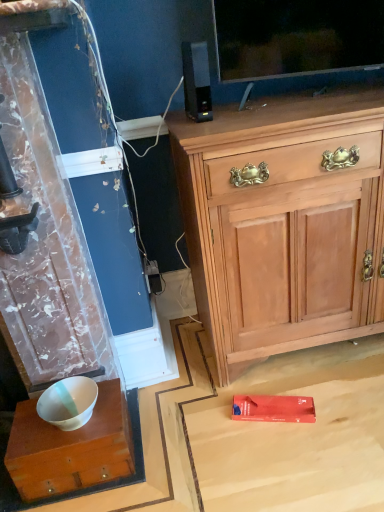
Looking at this image, what is the approximate width of white glossy wood desk at lower left?

white glossy wood desk at lower left is 10.25 inches wide.

Image resolution: width=384 pixels, height=512 pixels. What are the coordinates of `light wood cabinet at upper right` in the screenshot? It's located at (283, 223).

This screenshot has width=384, height=512. I want to click on white glossy wood desk at lower left, so click(70, 448).

Locate an element on the screen. Image resolution: width=384 pixels, height=512 pixels. cabinetry beneath the black plastic speaker at upper center (from a real-world perspective) is located at coordinates (283, 223).

Who is taller, light wood cabinet at upper right or black plastic speaker at upper center?

Answer: With more height is light wood cabinet at upper right.

Is light wood cabinet at upper right positioned beyond the bounds of black plastic speaker at upper center?

Yes, light wood cabinet at upper right is located beyond the bounds of black plastic speaker at upper center.

From a real-world perspective, is light wood cabinet at upper right above or below black plastic speaker at upper center?

light wood cabinet at upper right is below black plastic speaker at upper center.

Can you confirm if white glossy wood desk at lower left is wider than light wood cabinet at upper right?

No, white glossy wood desk at lower left is not wider than light wood cabinet at upper right.

Is white glossy wood desk at lower left aimed at light wood cabinet at upper right?

No, white glossy wood desk at lower left is not facing towards light wood cabinet at upper right.

From the image's perspective, is white glossy wood desk at lower left located beneath light wood cabinet at upper right?

Yes, from the image's perspective, white glossy wood desk at lower left is below light wood cabinet at upper right.

Which is less distant, (57,468) or (249,112)?

Point (57,468) is closer to the camera than point (249,112).

Who is bigger, black plastic speaker at upper center or light wood cabinet at upper right?

light wood cabinet at upper right.

Between black plastic speaker at upper center and light wood cabinet at upper right, which one appears on the right side from the viewer's perspective?

Positioned to the right is light wood cabinet at upper right.

Locate an element on the screen. This screenshot has width=384, height=512. loudspeaker lying above the light wood cabinet at upper right (from the image's perspective) is located at coordinates (196, 81).

Measure the distance between light wood cabinet at upper right and white glossy wood desk at lower left.

light wood cabinet at upper right and white glossy wood desk at lower left are 26.44 inches apart from each other.

Is light wood cabinet at upper right inside or outside of white glossy wood desk at lower left?

light wood cabinet at upper right lies outside white glossy wood desk at lower left.

This screenshot has width=384, height=512. I want to click on cabinetry located above the white glossy wood desk at lower left (from a real-world perspective), so click(283, 223).

Can you confirm if light wood cabinet at upper right is smaller than white glossy wood desk at lower left?

No.

Between white glossy wood desk at lower left and black plastic speaker at upper center, which one has more height?

Standing taller between the two is black plastic speaker at upper center.

Considering their positions, is white glossy wood desk at lower left located in front of or behind black plastic speaker at upper center?

white glossy wood desk at lower left is positioned closer to the viewer than black plastic speaker at upper center.

Is point (38, 428) more distant than point (191, 71)?

Yes, point (38, 428) is behind point (191, 71).

Considering the sizes of white glossy wood desk at lower left and black plastic speaker at upper center in the image, is white glossy wood desk at lower left wider or thinner than black plastic speaker at upper center?

white glossy wood desk at lower left is wider than black plastic speaker at upper center.

Between black plastic speaker at upper center and white glossy wood desk at lower left, which one has smaller size?

black plastic speaker at upper center is smaller.

From their relative heights in the image, would you say black plastic speaker at upper center is taller or shorter than white glossy wood desk at lower left?

black plastic speaker at upper center is taller than white glossy wood desk at lower left.

Would you say black plastic speaker at upper center is inside or outside white glossy wood desk at lower left?

black plastic speaker at upper center is spatially situated outside white glossy wood desk at lower left.

Where is `cabinetry on the right side of black plastic speaker at upper center`? cabinetry on the right side of black plastic speaker at upper center is located at coordinates tap(283, 223).

The width and height of the screenshot is (384, 512). I want to click on desk located behind the light wood cabinet at upper right, so click(70, 448).

When comparing their distances from black plastic speaker at upper center, does light wood cabinet at upper right or white glossy wood desk at lower left seem further?

white glossy wood desk at lower left lies further to black plastic speaker at upper center than the other object.

Estimate the real-world distances between objects in this image. Which object is closer to light wood cabinet at upper right, white glossy wood desk at lower left or black plastic speaker at upper center?

Based on the image, black plastic speaker at upper center appears to be nearer to light wood cabinet at upper right.

Estimate the real-world distances between objects in this image. Which object is closer to light wood cabinet at upper right, black plastic speaker at upper center or white glossy wood desk at lower left?

black plastic speaker at upper center is closer to light wood cabinet at upper right.

Looking at the image, which one is located further to white glossy wood desk at lower left, black plastic speaker at upper center or light wood cabinet at upper right?

black plastic speaker at upper center.

Which object lies further to the anchor point white glossy wood desk at lower left, light wood cabinet at upper right or black plastic speaker at upper center?

black plastic speaker at upper center lies further to white glossy wood desk at lower left than the other object.

In the scene shown: Looking at the image, which one is located further to black plastic speaker at upper center, white glossy wood desk at lower left or light wood cabinet at upper right?

Among the two, white glossy wood desk at lower left is located further to black plastic speaker at upper center.

Identify the location of cabinetry between black plastic speaker at upper center and white glossy wood desk at lower left vertically. (283, 223).